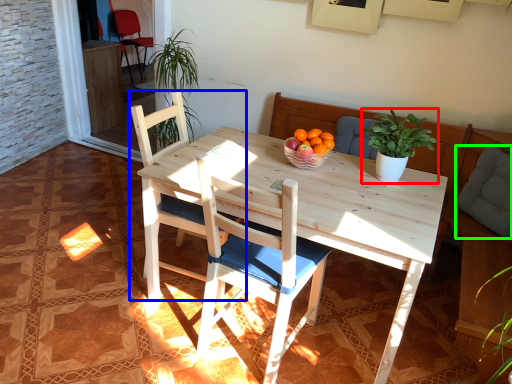
Question: Considering the real-world distances, which object is farthest from houseplant (highlighted by a red box)? chair (highlighted by a blue box) or pillow (highlighted by a green box)?

Choices:
 (A) chair
 (B) pillow

Answer: (A)